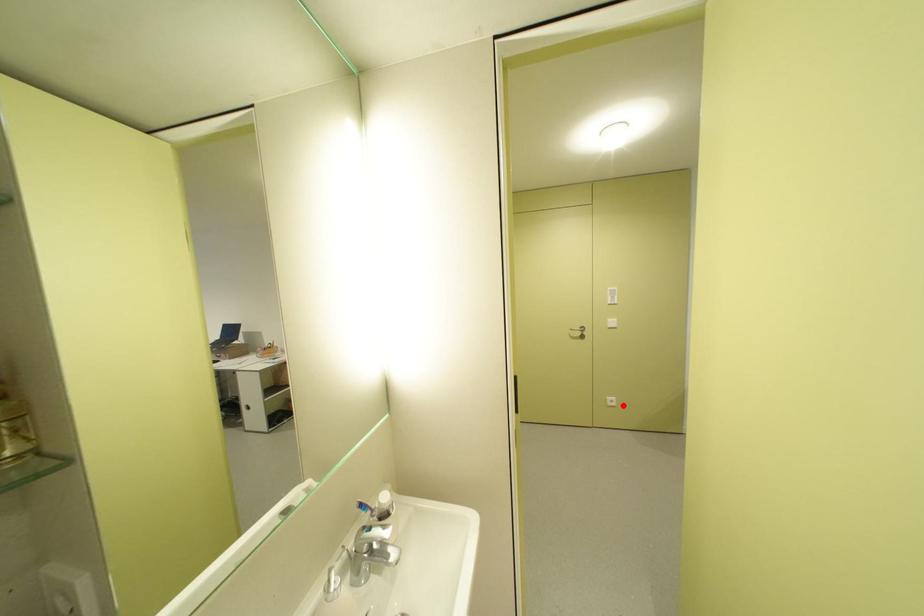
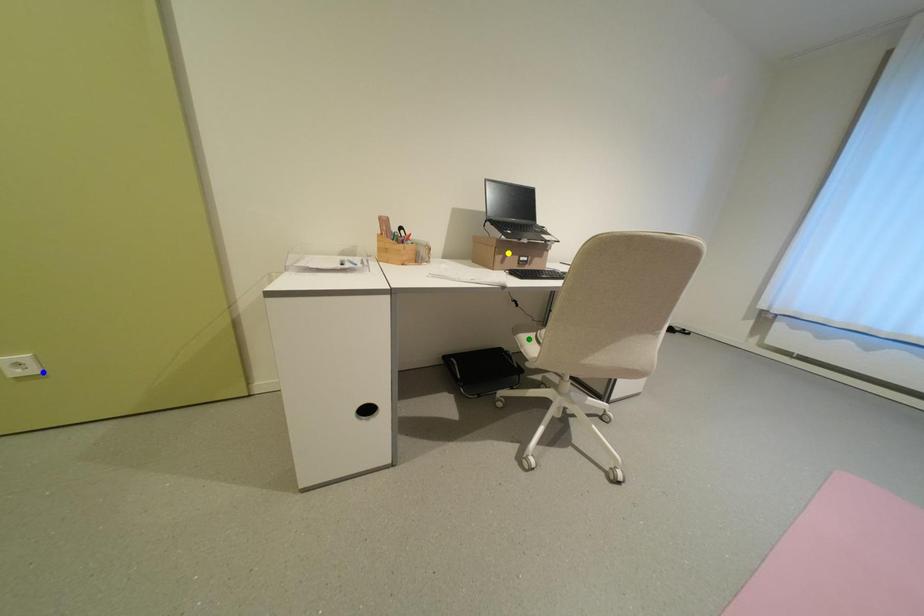
Question: I am providing you with two images of the same scene from different viewpoints. A red point is marked on the first image. You are given multiple points on the second image. Which point in image 2 is actually the same real-world point as the red point in image 1?

Choices:
 (A) yellow point
 (B) green point
 (C) blue point

Answer: (C)